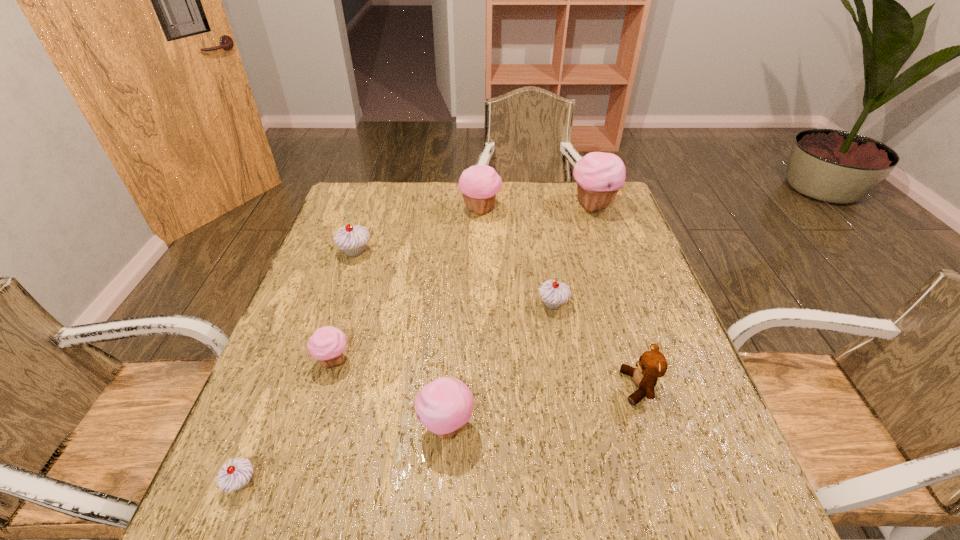
Where is `the leftmost pink cupcake`? The width and height of the screenshot is (960, 540). the leftmost pink cupcake is located at coordinates (327, 344).

At what (x,y) coordinates should I click in order to perform the action: click on the smallest pink cupcake. Please return your answer as a coordinate pair (x, y). This screenshot has width=960, height=540. Looking at the image, I should click on (327, 344).

At what (x,y) coordinates should I click in order to perform the action: click on the nearest gray cupcake. Please return your answer as a coordinate pair (x, y). The width and height of the screenshot is (960, 540). Looking at the image, I should click on (235, 475).

The width and height of the screenshot is (960, 540). I want to click on the nearest cupcake, so click(x=235, y=475).

Locate an element on the screen. The height and width of the screenshot is (540, 960). vacant area located on the front of the tallest cupcake is located at coordinates (613, 263).

At what (x,y) coordinates should I click in order to perform the action: click on vacant space located on the front of the second biggest pink cupcake. Please return your answer as a coordinate pair (x, y). Looking at the image, I should click on (480, 288).

The image size is (960, 540). I want to click on free space located on the right of the third farthest cupcake, so click(x=453, y=252).

Where is `free location located 0.360m on the front of the fourth farthest cupcake`? This screenshot has height=540, width=960. free location located 0.360m on the front of the fourth farthest cupcake is located at coordinates (579, 460).

Image resolution: width=960 pixels, height=540 pixels. In order to click on vacant space located 0.200m on the left of the sixth farthest cupcake in this screenshot , I will do `click(316, 427)`.

You are a GUI agent. You are given a task and a screenshot of the screen. Output one action in this format:
    pyautogui.click(x=<x>, y=<y>)
    Task: Click on the vacant region located 0.220m on the front-facing side of the teddy bear
    This screenshot has width=960, height=540.
    Given the screenshot: What is the action you would take?
    pyautogui.click(x=517, y=387)